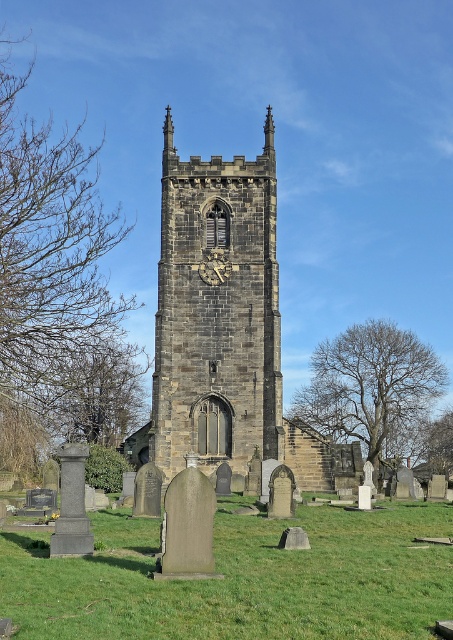
Question: From the image, what is the correct spatial relationship of green grass at lower center in relation to dark gray stone clock at center?

Choices:
 (A) below
 (B) above

Answer: (A)

Question: Which point is closer to the camera taking this photo?

Choices:
 (A) (144, 566)
 (B) (197, 401)
 (C) (220, 268)

Answer: (A)

Question: Which object is positioned farthest from the dark gray stone clock at center?

Choices:
 (A) dark gray stone church tower at center
 (B) green grass at lower center

Answer: (B)

Question: Which of the following is the farthest from the observer?

Choices:
 (A) green grass at lower center
 (B) dark gray stone church tower at center

Answer: (B)

Question: Is the position of dark gray stone church tower at center more distant than that of dark gray stone clock at center?

Choices:
 (A) no
 (B) yes

Answer: (A)

Question: Can you confirm if green grass at lower center is positioned to the right of dark gray stone church tower at center?

Choices:
 (A) no
 (B) yes

Answer: (B)